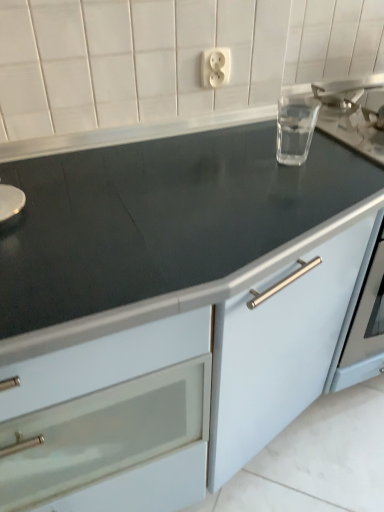
At what (x,y) coordinates should I click in order to perform the action: click on free location in front of transparent glass at upper right. Please return your answer as a coordinate pair (x, y). The height and width of the screenshot is (512, 384). Looking at the image, I should click on (298, 194).